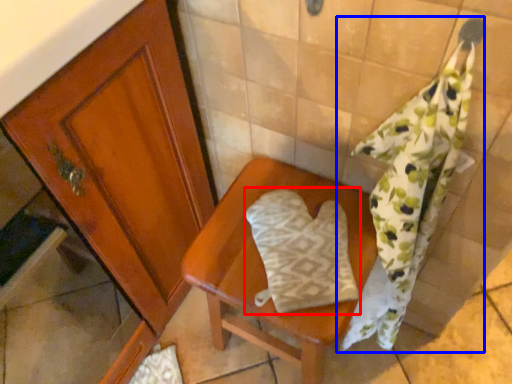
Question: Which object is closer to the camera taking this photo, throw pillow (highlighted by a red box) or bath towel (highlighted by a blue box)?

Choices:
 (A) throw pillow
 (B) bath towel

Answer: (B)